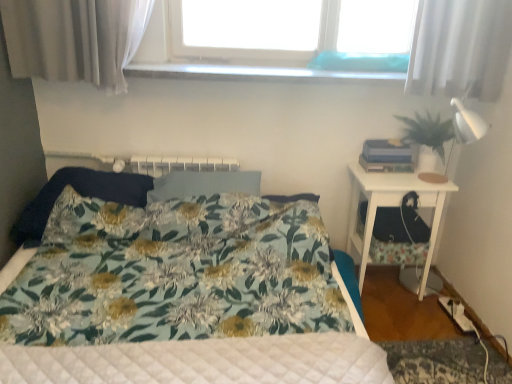
Locate an element on the screen. clear glass window sill at upper center is located at coordinates (257, 73).

The image size is (512, 384). What do you see at coordinates (460, 48) in the screenshot? I see `white sheer curtain at upper right` at bounding box center [460, 48].

In order to face white sheer curtain at upper right, should I rotate leftwards or rightwards?

Turn right approximately 25.617 degrees to face it.

This screenshot has height=384, width=512. What do you see at coordinates (180, 296) in the screenshot? I see `floral fabric bed at center` at bounding box center [180, 296].

Image resolution: width=512 pixels, height=384 pixels. Identify the location of white glossy nightstand at right. (392, 206).

Where is `dark blue fabric pillow at left, which appears as the 2th pillow when viewed from the right`? dark blue fabric pillow at left, which appears as the 2th pillow when viewed from the right is located at coordinates (81, 195).

Does green matte plant at right have a greater width compared to clear glass window sill at upper center?

No, green matte plant at right is not wider than clear glass window sill at upper center.

How different are the orientations of green matte plant at right and clear glass window sill at upper center in degrees?

0.919 degrees separate the facing orientations of green matte plant at right and clear glass window sill at upper center.

Looking at this image, from a real-world perspective, is green matte plant at right located higher than clear glass window sill at upper center?

No, from a real-world perspective, green matte plant at right is not over clear glass window sill at upper center

Is green matte plant at right turned away from clear glass window sill at upper center?

No, green matte plant at right is not facing away from clear glass window sill at upper center.

Are fluffy fabric pillow at center, placed as the 2th pillow when sorted from left to right, and white glossy nightstand at right far apart?

No, fluffy fabric pillow at center, placed as the 2th pillow when sorted from left to right, is not far away from white glossy nightstand at right.

Who is taller, fluffy fabric pillow at center, which is the first pillow in right-to-left order, or white glossy nightstand at right?

With more height is white glossy nightstand at right.

Consider the image. From the image's perspective, is fluffy fabric pillow at center, which is the first pillow in right-to-left order, above white glossy nightstand at right?

Yes, from the image's perspective, fluffy fabric pillow at center, which is the first pillow in right-to-left order, is over white glossy nightstand at right.

Based on the photo, considering the sizes of fluffy fabric pillow at center, which is the first pillow in right-to-left order, and white glossy nightstand at right in the image, is fluffy fabric pillow at center, which is the first pillow in right-to-left order, wider or thinner than white glossy nightstand at right?

In the image, fluffy fabric pillow at center, which is the first pillow in right-to-left order, appears to be more narrow than white glossy nightstand at right.

Between floral fabric bed at center and green matte plant at right, which one has smaller size?

Smaller between the two is green matte plant at right.

From the image's perspective, would you say floral fabric bed at center is shown under green matte plant at right?

Indeed, from the image's perspective, floral fabric bed at center is shown beneath green matte plant at right.

How many degrees apart are the facing directions of floral fabric bed at center and green matte plant at right?

3.41 degrees.

Based on the photo, considering the sizes of objects floral fabric bed at center and green matte plant at right in the image provided, who is wider, floral fabric bed at center or green matte plant at right?

With larger width is floral fabric bed at center.

Which of these two, dark blue fabric pillow at left, the first pillow when ordered from left to right, or white glossy nightstand at right, stands shorter?

With less height is dark blue fabric pillow at left, the first pillow when ordered from left to right.

From the image's perspective, is dark blue fabric pillow at left, which appears as the 2th pillow when viewed from the right, above or below white glossy nightstand at right?

From the image's perspective, dark blue fabric pillow at left, which appears as the 2th pillow when viewed from the right, appears above white glossy nightstand at right.

Is the surface of dark blue fabric pillow at left, which appears as the 2th pillow when viewed from the right, in direct contact with white glossy nightstand at right?

No, dark blue fabric pillow at left, which appears as the 2th pillow when viewed from the right, is not making contact with white glossy nightstand at right.

From the picture: From the image's perspective, between fluffy fabric pillow at center, placed as the 2th pillow when sorted from left to right, and dark blue fabric pillow at left, which appears as the 2th pillow when viewed from the right, who is located below?

dark blue fabric pillow at left, which appears as the 2th pillow when viewed from the right, from the image's perspective.

Is fluffy fabric pillow at center, which is the first pillow in right-to-left order, turned away from dark blue fabric pillow at left, which appears as the 2th pillow when viewed from the right?

No, dark blue fabric pillow at left, which appears as the 2th pillow when viewed from the right, is not at the back of fluffy fabric pillow at center, which is the first pillow in right-to-left order.

Between fluffy fabric pillow at center, placed as the 2th pillow when sorted from left to right, and dark blue fabric pillow at left, the first pillow when ordered from left to right, which one has smaller size?

With smaller size is fluffy fabric pillow at center, placed as the 2th pillow when sorted from left to right.

Looking at their sizes, would you say fluffy fabric pillow at center, placed as the 2th pillow when sorted from left to right, is wider or thinner than dark blue fabric pillow at left, which appears as the 2th pillow when viewed from the right?

In the image, fluffy fabric pillow at center, placed as the 2th pillow when sorted from left to right, appears to be more narrow than dark blue fabric pillow at left, which appears as the 2th pillow when viewed from the right.

Is point (406, 132) closer to camera compared to point (428, 234)?

No, it is behind (428, 234).

What's the angular difference between green matte plant at right and black fabric at right's facing directions?

green matte plant at right and black fabric at right are facing 5.1e-05 degrees away from each other.

Is green matte plant at right positioned with its back to black fabric at right?

No.

Is green matte plant at right to the right of black fabric at right from the viewer's perspective?

Correct, you'll find green matte plant at right to the right of black fabric at right.

From the image's perspective, is fluffy fabric pillow at center, placed as the 2th pillow when sorted from left to right, on black fabric at right?

Yes, from the image's perspective, fluffy fabric pillow at center, placed as the 2th pillow when sorted from left to right, is over black fabric at right.

In the scene shown: Is fluffy fabric pillow at center, placed as the 2th pillow when sorted from left to right, beside black fabric at right?

No, fluffy fabric pillow at center, placed as the 2th pillow when sorted from left to right, is not with black fabric at right.

Is fluffy fabric pillow at center, placed as the 2th pillow when sorted from left to right, oriented towards black fabric at right?

No, fluffy fabric pillow at center, placed as the 2th pillow when sorted from left to right, is not facing towards black fabric at right.

From the picture: Can you tell me how much fluffy fabric pillow at center, placed as the 2th pillow when sorted from left to right, and black fabric at right differ in facing direction?

fluffy fabric pillow at center, placed as the 2th pillow when sorted from left to right, and black fabric at right are facing 3.54 degrees away from each other.

You are a GUI agent. You are given a task and a screenshot of the screen. Output one action in this format:
    pyautogui.click(x=<x>, y=<y>)
    Task: Click on the plant directly beneath the clear glass window sill at upper center (from a real-world perspective)
    The image size is (512, 384).
    Given the screenshot: What is the action you would take?
    pyautogui.click(x=428, y=131)

There is a white glossy nightstand at right. At what (x,y) coordinates should I click in order to perform the action: click on the 2nd pillow above it (from a real-world perspective). Please return your answer as a coordinate pair (x, y). This screenshot has height=384, width=512. Looking at the image, I should click on (204, 184).

From the picture: Considering their positions, is white sheer curtain at upper right positioned further to green matte plant at right than floral fabric bed at center?

floral fabric bed at center is further to green matte plant at right.

Estimate the real-world distances between objects in this image. Which object is closer to dark blue fabric pillow at left, the first pillow when ordered from left to right, black fabric at right or floral fabric bed at center?

floral fabric bed at center is closer to dark blue fabric pillow at left, the first pillow when ordered from left to right.

Which object lies further to the anchor point white sheer curtain at upper right, fluffy fabric pillow at center, which is the first pillow in right-to-left order, or dark blue fabric pillow at left, which appears as the 2th pillow when viewed from the right?

dark blue fabric pillow at left, which appears as the 2th pillow when viewed from the right, is positioned further to the anchor white sheer curtain at upper right.

Which object lies further to the anchor point white glossy nightstand at right, green matte plant at right or white sheer curtain at upper right?

white sheer curtain at upper right.

Estimate the real-world distances between objects in this image. Which object is further from white glossy nightstand at right, green matte plant at right or floral fabric bed at center?

floral fabric bed at center is positioned further to the anchor white glossy nightstand at right.

Based on their spatial positions, is fluffy fabric pillow at center, placed as the 2th pillow when sorted from left to right, or floral fabric bed at center closer to white sheer curtain at upper right?

Based on the image, fluffy fabric pillow at center, placed as the 2th pillow when sorted from left to right, appears to be nearer to white sheer curtain at upper right.

Estimate the real-world distances between objects in this image. Which object is closer to white glossy nightstand at right, green matte plant at right or fluffy fabric pillow at center, placed as the 2th pillow when sorted from left to right?

Based on the image, green matte plant at right appears to be nearer to white glossy nightstand at right.

When comparing their distances from black fabric at right, does floral fabric bed at center or green matte plant at right seem further?

Based on the image, floral fabric bed at center appears to be further to black fabric at right.

The height and width of the screenshot is (384, 512). What are the coordinates of `window sill between fluffy fabric pillow at center, which is the first pillow in right-to-left order, and green matte plant at right` in the screenshot? It's located at (257, 73).

Identify the location of footrest between dark blue fabric pillow at left, the first pillow when ordered from left to right, and green matte plant at right. (400, 225).

Locate an element on the screen. window sill located between dark blue fabric pillow at left, which appears as the 2th pillow when viewed from the right, and white glossy nightstand at right in the left-right direction is located at coordinates (257, 73).

At what (x,y) coordinates should I click in order to perform the action: click on pillow between floral fabric bed at center and fluffy fabric pillow at center, placed as the 2th pillow when sorted from left to right, from front to back. Please return your answer as a coordinate pair (x, y). Looking at the image, I should click on (81, 195).